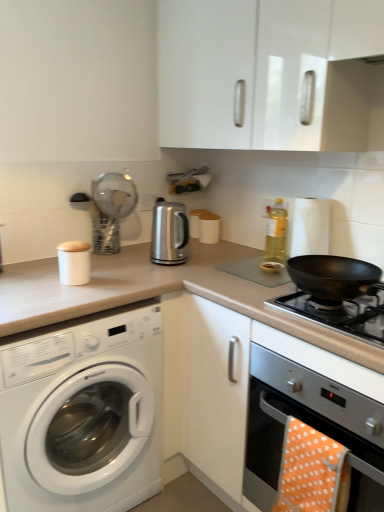
Question: From the image's perspective, relative to white matte container at upper left, arranged as the 1th appliance when viewed from the left, is metal mesh strainer at upper center, the 2th appliance in the left-to-right sequence, above or below?

Choices:
 (A) below
 (B) above

Answer: (B)

Question: Which is correct: metal mesh strainer at upper center, the 2th appliance in the left-to-right sequence, is inside white matte container at upper left, acting as the fourth appliance starting from the right, or outside of it?

Choices:
 (A) inside
 (B) outside

Answer: (B)

Question: Which object is positioned farthest from the white glossy washing machine at left?

Choices:
 (A) white matte container at upper left, acting as the fourth appliance starting from the right
 (B) metal mesh strainer at upper center, the third appliance when ordered from right to left
 (C) black matte pan at right
 (D) black matte wok at right
 (E) glossy white cabinet at upper center

Answer: (E)

Question: Which object is positioned closest to the black matte pan at right?

Choices:
 (A) orange polka dot towel at lower right
 (B) yellow translucent bottle at upper right
 (C) satin silver oven at lower right
 (D) beige laminate countertop at center
 (E) white matte container at upper left, acting as the fourth appliance starting from the right

Answer: (C)